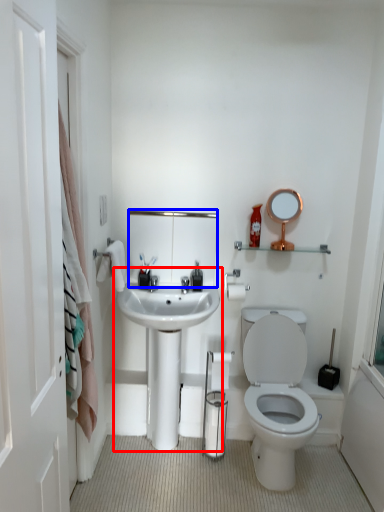
Question: Which point is further to the camera, sink (highlighted by a red box) or mirror (highlighted by a blue box)?

Choices:
 (A) sink
 (B) mirror

Answer: (B)